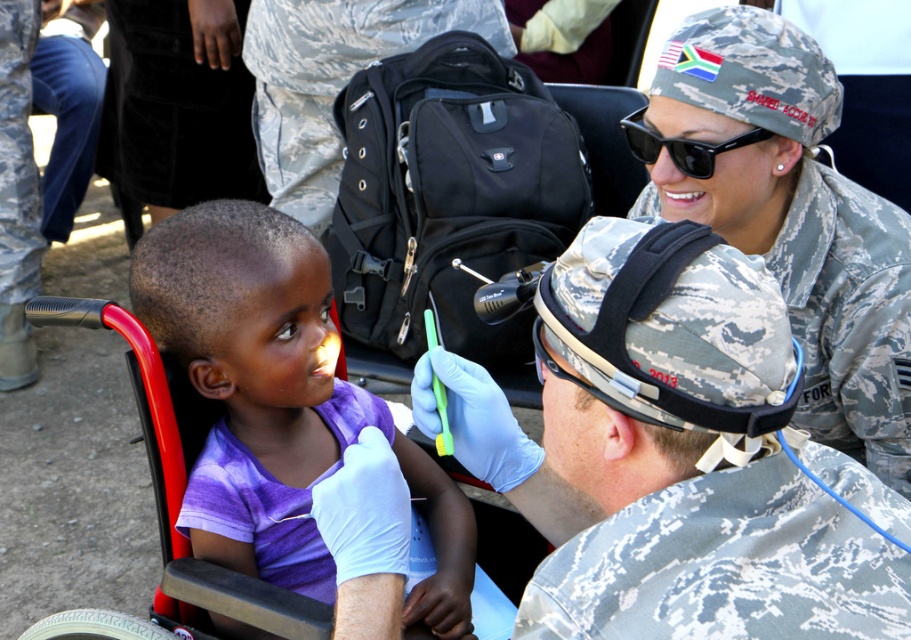
You are a photographer positioned at the scene of a dental checkup. You need to capture a closeup shot of the purple cotton shirt at center. Given that the shirt is 4.74 feet away from you, can you adjust your camera settings to focus on it clearly without blurring the background?

The purple cotton shirt at center is 4.74 feet away from the viewer. To focus clearly on it while blurring the background, adjust your camera to a wide aperture setting to achieve a shallow depth of field.

What are the coordinates of the camouflage fabric helmet at center?

The camouflage fabric helmet at center is located at coordinates point (667, 460).

You are a photographer at the scene and need to frame a photo so that both the camouflage fabric helmet at center and the purple cotton shirt at center are visible. Given their widths, which object should be placed closer to the edge of the frame to ensure both fit within the shot?

The purple cotton shirt at center is narrower than the camouflage fabric helmet at center. To fit both within the frame, position the narrower purple cotton shirt at center closer to the edge so that the wider camouflage fabric helmet at center can occupy more space in the center.